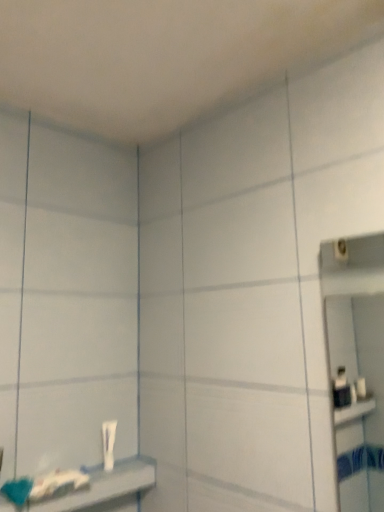
Question: Should I look upward or downward to see white glossy tube at lower left?

Choices:
 (A) up
 (B) down

Answer: (B)

Question: Is white glossy shelf at lower left facing towards white glossy tube at lower left?

Choices:
 (A) no
 (B) yes

Answer: (A)

Question: Is white glossy shelf at lower left turned away from white glossy tube at lower left?

Choices:
 (A) yes
 (B) no

Answer: (B)

Question: From the image's perspective, is white glossy shelf at lower left below white glossy tube at lower left?

Choices:
 (A) no
 (B) yes

Answer: (B)

Question: Does white glossy shelf at lower left appear on the left side of white glossy tube at lower left?

Choices:
 (A) no
 (B) yes

Answer: (B)

Question: Is white glossy shelf at lower left far away from white glossy tube at lower left?

Choices:
 (A) yes
 (B) no

Answer: (B)

Question: From the image's perspective, does white glossy shelf at lower left appear higher than white glossy tube at lower left?

Choices:
 (A) yes
 (B) no

Answer: (B)

Question: Is white glossy tube at lower left at the left side of white glossy shelf at lower left?

Choices:
 (A) yes
 (B) no

Answer: (B)

Question: From a real-world perspective, is white glossy tube at lower left positioned over white glossy shelf at lower left based on gravity?

Choices:
 (A) yes
 (B) no

Answer: (A)

Question: Considering the relative sizes of white glossy tube at lower left and white glossy shelf at lower left in the image provided, is white glossy tube at lower left taller than white glossy shelf at lower left?

Choices:
 (A) no
 (B) yes

Answer: (B)

Question: Are white glossy tube at lower left and white glossy shelf at lower left located far from each other?

Choices:
 (A) no
 (B) yes

Answer: (A)

Question: Can you confirm if white glossy tube at lower left is bigger than white glossy shelf at lower left?

Choices:
 (A) yes
 (B) no

Answer: (B)

Question: Is white glossy tube at lower left positioned with its back to white glossy shelf at lower left?

Choices:
 (A) yes
 (B) no

Answer: (B)

Question: Considering the positions of white glossy tube at lower left and white glossy shelf at lower left in the image, is white glossy tube at lower left taller or shorter than white glossy shelf at lower left?

Choices:
 (A) short
 (B) tall

Answer: (B)